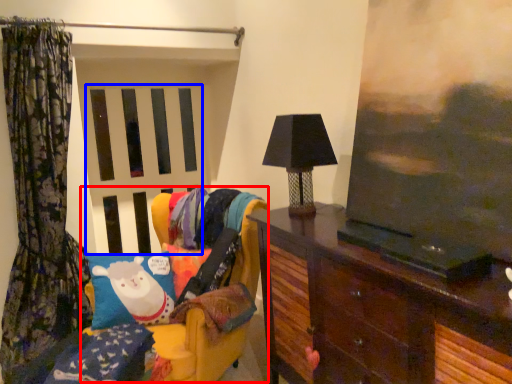
Question: Among these objects, which one is farthest to the camera, swivel chair (highlighted by a red box) or screen door (highlighted by a blue box)?

Choices:
 (A) swivel chair
 (B) screen door

Answer: (B)